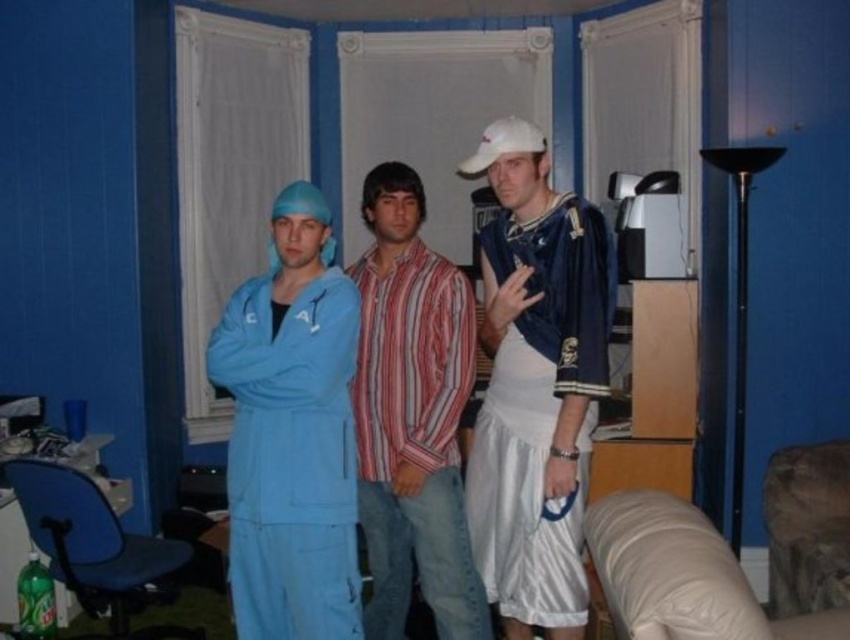
Question: Which object is closer to the camera taking this photo?

Choices:
 (A) light blue matte jumpsuit at center
 (B) white matte baseball cap at upper center

Answer: (A)

Question: Does white matte baseball cap at upper center lie in front of striped cotton shirt at center?

Choices:
 (A) yes
 (B) no

Answer: (A)

Question: Which object appears closest to the camera in this image?

Choices:
 (A) striped cotton shirt at center
 (B) white matte baseball cap at upper center

Answer: (B)

Question: Does white matte baseball cap at upper center have a greater width compared to light blue matte jumpsuit at center?

Choices:
 (A) yes
 (B) no

Answer: (B)

Question: Estimate the real-world distances between objects in this image. Which object is farther from the striped cotton shirt at center?

Choices:
 (A) white matte baseball cap at upper center
 (B) light blue matte jumpsuit at center

Answer: (B)

Question: Can you confirm if white matte baseball cap at upper center is positioned below striped cotton shirt at center?

Choices:
 (A) no
 (B) yes

Answer: (A)